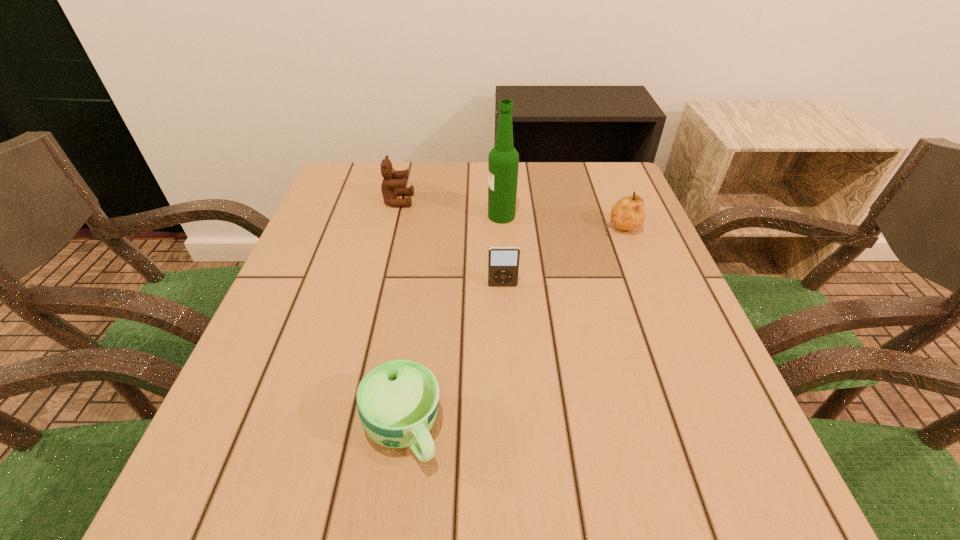
Locate an element on the screen. The image size is (960, 540). beer bottle is located at coordinates (503, 161).

Identify the location of teddy bear. (394, 184).

Where is `the rightmost object`? the rightmost object is located at coordinates (628, 213).

Locate an element on the screen. iPod is located at coordinates (503, 262).

This screenshot has width=960, height=540. I want to click on cup, so click(x=397, y=400).

Find the location of a particular element. This screenshot has width=960, height=540. vacant region located 0.330m on the label of the tallest object is located at coordinates (352, 216).

Find the location of a particular element. This screenshot has width=960, height=540. vacant region located 0.210m on the label of the tallest object is located at coordinates (402, 216).

What are the coordinates of `blank space located 0.310m on the label of the tallest object` in the screenshot? It's located at (361, 216).

The image size is (960, 540). I want to click on vacant region located 0.370m on the face of the teddy bear, so click(558, 200).

The height and width of the screenshot is (540, 960). Find the location of `vacant space located on the left of the rightmost object`. vacant space located on the left of the rightmost object is located at coordinates (468, 229).